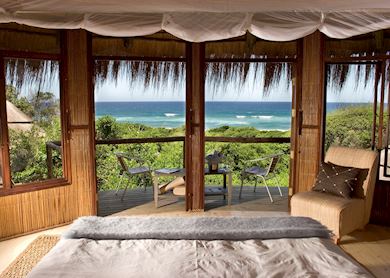
Find the location of a particular element. The height and width of the screenshot is (278, 390). floor is located at coordinates (10, 249).